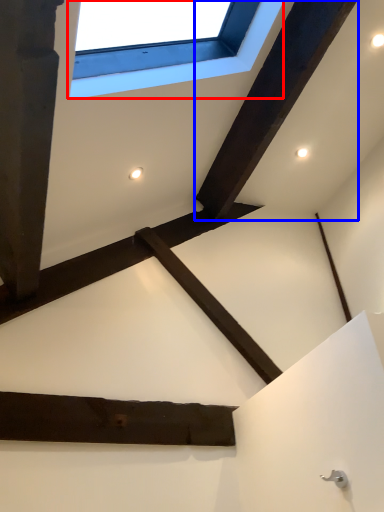
Question: Which point is further to the camera, window (highlighted by a red box) or plank (highlighted by a blue box)?

Choices:
 (A) window
 (B) plank

Answer: (B)